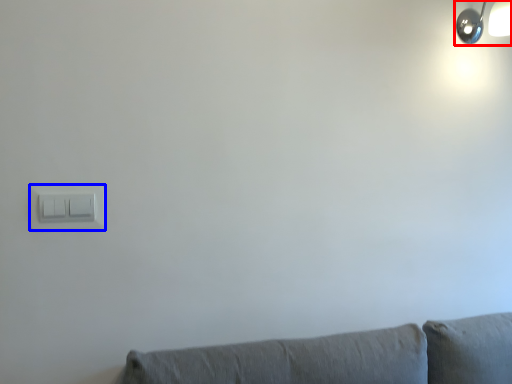
Question: Which object appears farthest to the camera in this image, lamp (highlighted by a red box) or light switch (highlighted by a blue box)?

Choices:
 (A) lamp
 (B) light switch

Answer: (A)